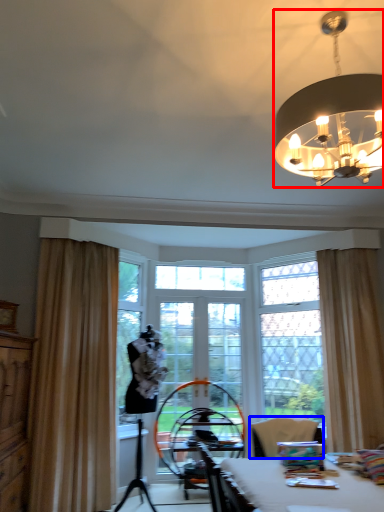
Question: Which object appears farthest to the camera in this image, lamp (highlighted by a red box) or chair (highlighted by a blue box)?

Choices:
 (A) lamp
 (B) chair

Answer: (B)